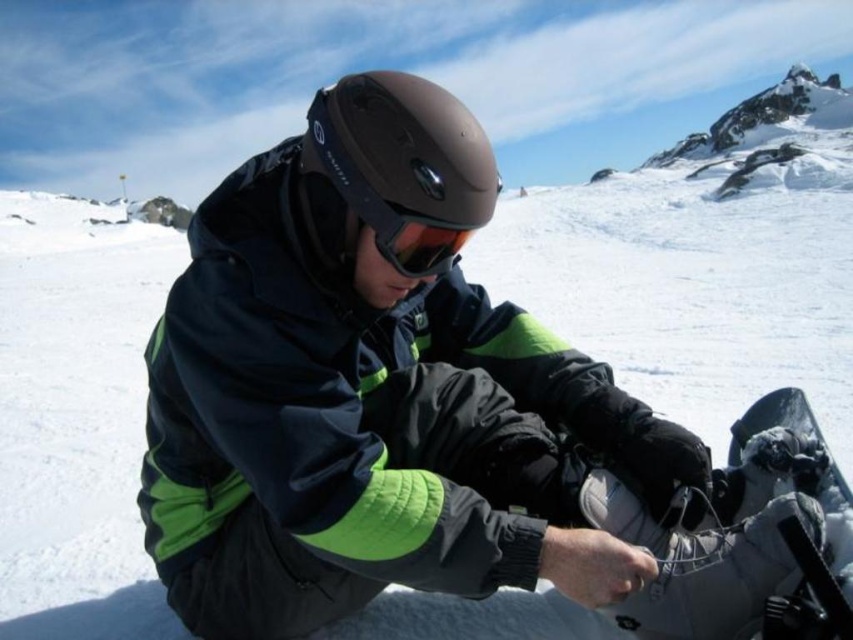
Does white matte snowboard at center have a smaller size compared to matte orange goggles at center?

Actually, white matte snowboard at center might be larger than matte orange goggles at center.

Identify the location of white matte snowboard at center. The image size is (853, 640). (798, 520).

Identify the location of white matte snowboard at center. This screenshot has height=640, width=853. (798, 520).

Between matte black helmet at center and matte orange goggles at center, which one appears on the right side from the viewer's perspective?

Positioned to the right is matte orange goggles at center.

Is point (244, 422) closer to camera compared to point (381, 211)?

Yes, point (244, 422) is in front of point (381, 211).

Locate an element on the screen. The width and height of the screenshot is (853, 640). matte black helmet at center is located at coordinates (379, 396).

Can you confirm if matte brown helmet at center is positioned to the right of white matte snowboard at center?

In fact, matte brown helmet at center is to the left of white matte snowboard at center.

Who is more distant from viewer, (466, 189) or (819, 488)?

The point (819, 488) is more distant.

This screenshot has width=853, height=640. What are the coordinates of `matte brown helmet at center` in the screenshot? It's located at (401, 173).